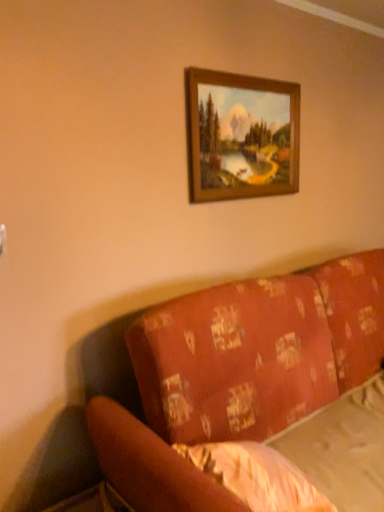
Question: Would you say patterned fabric couch at lower right is to the left or to the right of white textured sheet at lower right in the picture?

Choices:
 (A) left
 (B) right

Answer: (B)

Question: Considering the positions of point (198, 431) and point (288, 505), is point (198, 431) closer or farther from the camera than point (288, 505)?

Choices:
 (A) closer
 (B) farther

Answer: (B)

Question: Estimate the real-world distances between objects in this image. Which object is closer to the wooden frame at upper center?

Choices:
 (A) patterned fabric couch at lower right
 (B) white textured sheet at lower right

Answer: (A)

Question: Estimate the real-world distances between objects in this image. Which object is farther from the white textured sheet at lower right?

Choices:
 (A) patterned fabric couch at lower right
 (B) wooden frame at upper center

Answer: (B)